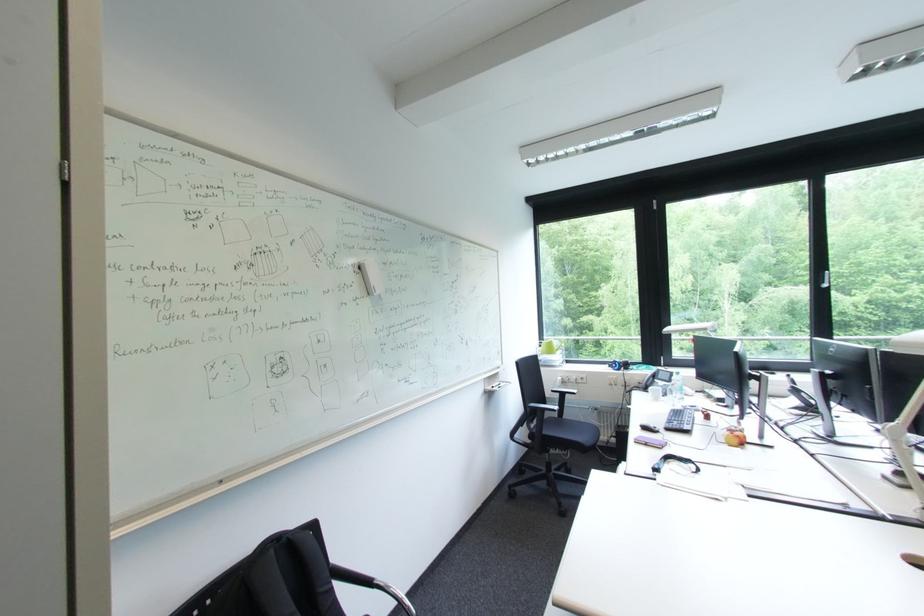
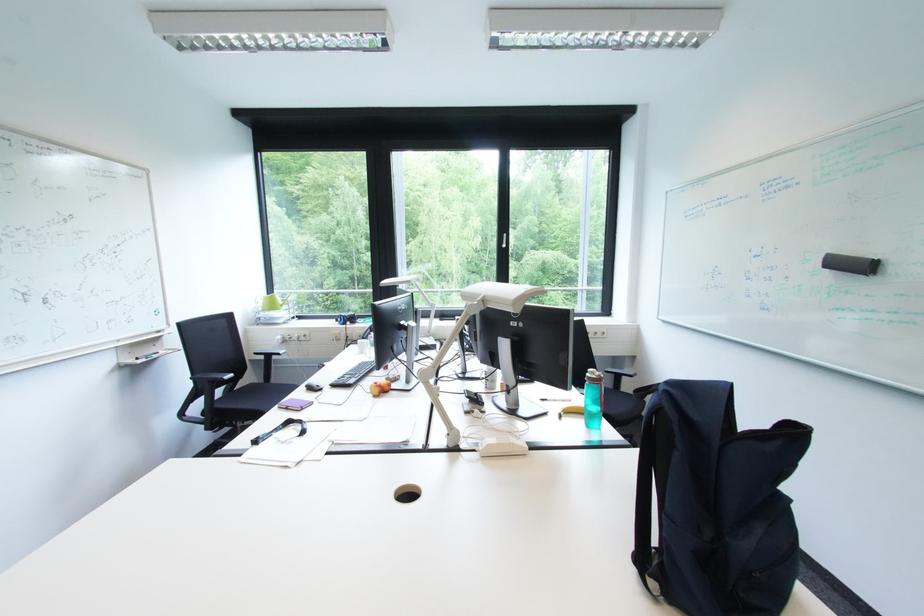
Question: The first image is from the beginning of the video and the second image is from the end. How did the camera likely rotate when shooting the video?

Choices:
 (A) Left
 (B) Right
 (C) Up
 (D) Down

Answer: (B)